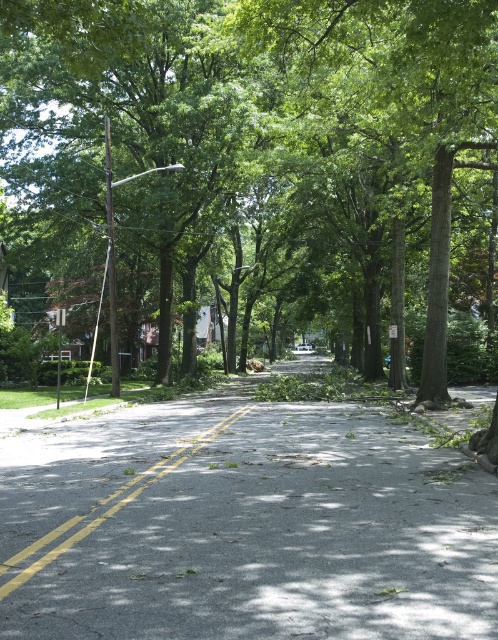
How distant is dark gray asphalt road at center from yellow asphalt road at center?

A distance of 7.25 feet exists between dark gray asphalt road at center and yellow asphalt road at center.

Who is more forward, (98, 456) or (19, 561)?

Point (19, 561)

What do you see at coordinates (244, 525) in the screenshot? I see `dark gray asphalt road at center` at bounding box center [244, 525].

I want to click on dark gray asphalt road at center, so click(x=244, y=525).

Can you confirm if green leafy tree at center is positioned above dark gray asphalt road at center?

Correct, green leafy tree at center is located above dark gray asphalt road at center.

Is green leafy tree at center to the left of dark gray asphalt road at center from the viewer's perspective?

Yes, green leafy tree at center is to the left of dark gray asphalt road at center.

Is point (294, 19) closer to viewer compared to point (159, 435)?

Yes, point (294, 19) is closer to viewer.

Identify the location of green leafy tree at center. This screenshot has height=640, width=498. (256, 164).

Is point (179, 200) farther from camera compared to point (16, 554)?

That is True.

Who is shorter, green leafy tree at center or yellow asphalt road at center?

yellow asphalt road at center

Is point (191, 241) positioned behind point (135, 481)?

That is True.

The image size is (498, 640). Identify the location of green leafy tree at center. (256, 164).